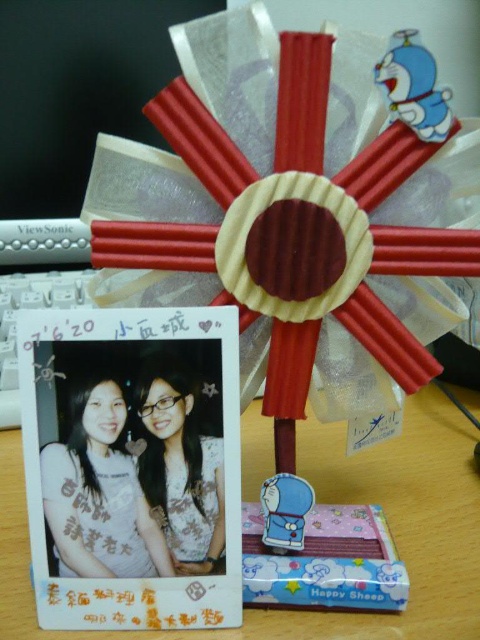
Is point (48, 513) in front of point (202, 504)?

Yes.

Does matte photo frame at center lie behind matte white blouse at center?

Yes, it is behind matte white blouse at center.

Locate an element on the screen. matte photo frame at center is located at coordinates (134, 481).

Is white glossy photo frame at center positioned before matte photo frame at center?

Yes.

The image size is (480, 640). What do you see at coordinates (324, 502) in the screenshot?
I see `white glossy photo frame at center` at bounding box center [324, 502].

Where is `white glossy photo frame at center`? Image resolution: width=480 pixels, height=640 pixels. white glossy photo frame at center is located at coordinates (324, 502).

Which is more to the right, white glossy photo frame at center or matte white blouse at center?

white glossy photo frame at center is more to the right.

Is white glossy photo frame at center bigger than matte white blouse at center?

Yes.

Is point (435, 554) farther from viewer compared to point (151, 508)?

Yes, point (435, 554) is farther from viewer.

Where is `white glossy photo frame at center`? white glossy photo frame at center is located at coordinates (324, 502).